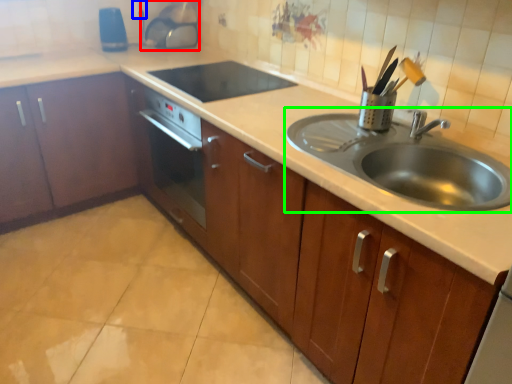
Question: Considering the real-world distances, which object is closest to appliance (highlighted by a red box)? electric outlet (highlighted by a blue box) or sink (highlighted by a green box).

Choices:
 (A) electric outlet
 (B) sink

Answer: (A)